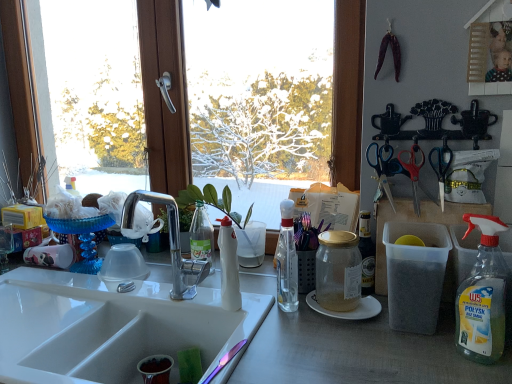
Where is `vacant space to the right of white matte bottle at center, which appears as the first bottle when viewed from the left`? Image resolution: width=512 pixels, height=384 pixels. vacant space to the right of white matte bottle at center, which appears as the first bottle when viewed from the left is located at coordinates (277, 312).